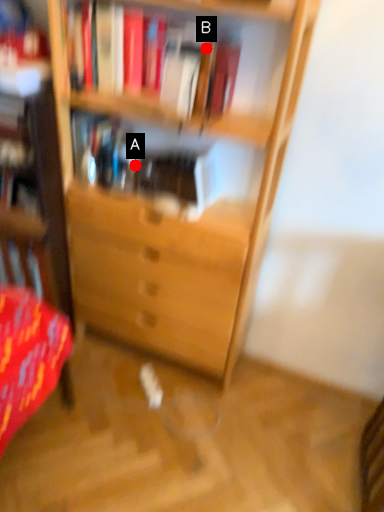
Question: Two points are circled on the image, labeled by A and B beside each circle. Among these points, which one is farthest from the camera?

Choices:
 (A) A is further
 (B) B is further

Answer: (A)